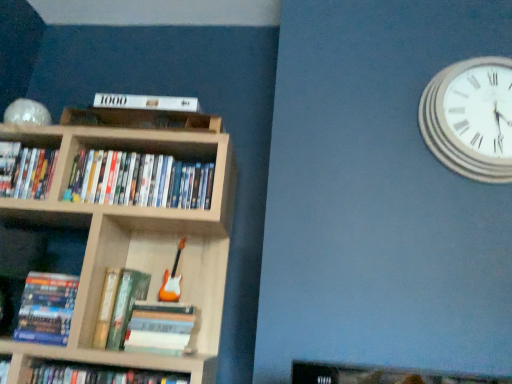
Question: From the image's perspective, is wooden bookcase at center positioned above or below matte cardboard book at lower left?

Choices:
 (A) above
 (B) below

Answer: (A)

Question: From a real-world perspective, is wooden bookcase at center physically located above or below matte cardboard book at lower left?

Choices:
 (A) below
 (B) above

Answer: (B)

Question: Which object is the closest to the hardcover book at lower left, the 2th book from the left?

Choices:
 (A) matte plastic dvds at center, acting as the fourth book starting from the left
 (B) matte cardboard book at lower left
 (C) matte black book at upper left, acting as the fifth book starting from the right
 (D) wooden bookcase at center
 (E) hardcover book at lower center, which ranks as the first book in right-to-left order

Answer: (B)

Question: Which object is positioned closest to the matte plastic dvds at center, which ranks as the 2th book in right-to-left order?

Choices:
 (A) matte black book at upper left, arranged as the first book when viewed from the left
 (B) matte cardboard book at lower left
 (C) hardcover book at lower center, marked as the fifth book in a left-to-right arrangement
 (D) white wooden clock at upper right
 (E) hardcover book at center, the 3th book from the right

Answer: (A)